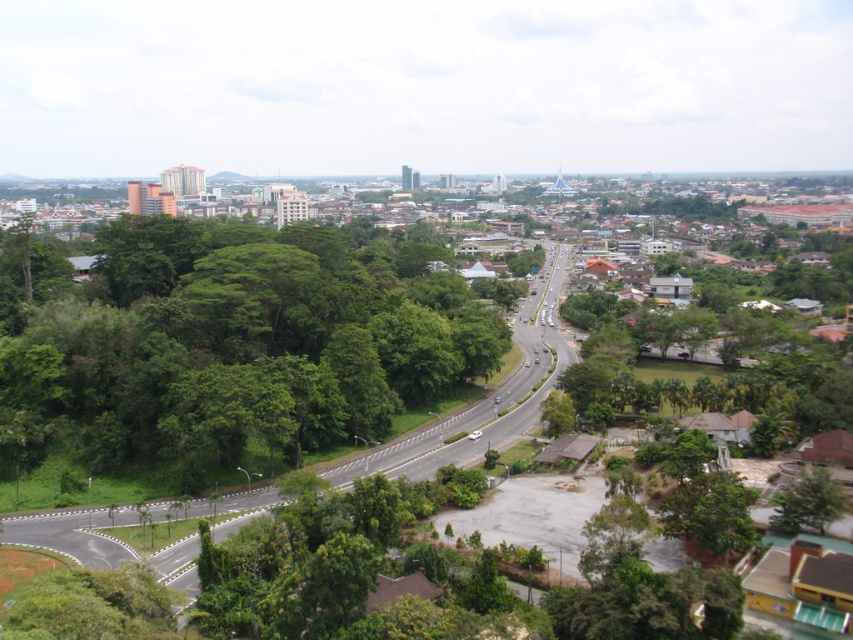
Can you confirm if green leafy highway at center is thinner than green leafy tree at lower right?

In fact, green leafy highway at center might be wider than green leafy tree at lower right.

Is green leafy highway at center to the right of green leafy tree at lower right from the viewer's perspective?

Incorrect, green leafy highway at center is not on the right side of green leafy tree at lower right.

Does point (94, 560) come closer to viewer compared to point (795, 525)?

No.

Where is `green leafy highway at center`? green leafy highway at center is located at coordinates (488, 396).